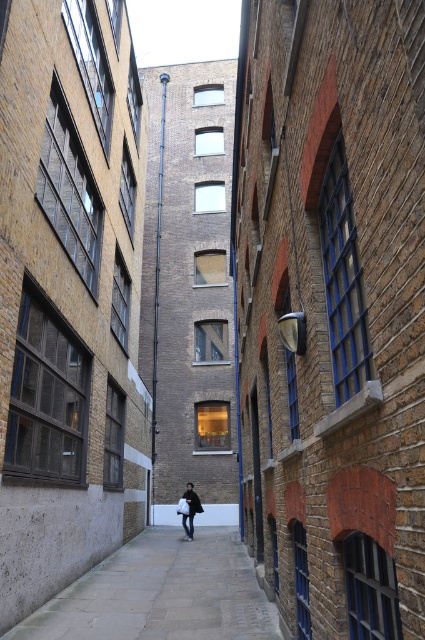
Question: Does paved stone pavement at center have a lesser width compared to dark brown leather coat at center?

Choices:
 (A) yes
 (B) no

Answer: (B)

Question: Does paved stone pavement at center appear under dark brown leather coat at center?

Choices:
 (A) no
 (B) yes

Answer: (A)

Question: Which object is farther from the camera taking this photo?

Choices:
 (A) paved stone pavement at center
 (B) dark brown leather coat at center

Answer: (B)

Question: Does paved stone pavement at center appear under dark brown leather coat at center?

Choices:
 (A) no
 (B) yes

Answer: (A)

Question: Which point is closer to the camera?

Choices:
 (A) (82, 589)
 (B) (190, 531)

Answer: (A)

Question: Among these points, which one is nearest to the camera?

Choices:
 (A) (187, 528)
 (B) (232, 609)

Answer: (B)